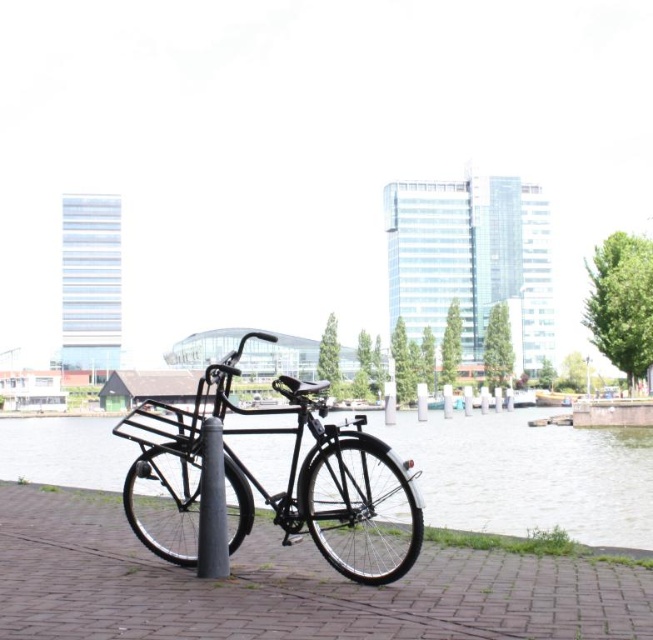
Does point (485, 584) come in front of point (471, 480)?

Yes, point (485, 584) is in front of point (471, 480).

Measure the distance between point (48, 589) and camera.

5.30 meters

Locate an element on the screen. black brick pavement at center is located at coordinates (287, 586).

Can you confirm if black brick pavement at center is positioned to the left of matte black bicycle at center?

In fact, black brick pavement at center is to the right of matte black bicycle at center.

Is black brick pavement at center closer to the viewer compared to matte black bicycle at center?

Yes.

The image size is (653, 640). In order to click on black brick pavement at center in this screenshot , I will do `click(287, 586)`.

Is clear water at center to the left of matte black bicycle at center from the viewer's perspective?

In fact, clear water at center is to the right of matte black bicycle at center.

Does clear water at center have a lesser height compared to matte black bicycle at center?

Incorrect, clear water at center's height does not fall short of matte black bicycle at center's.

The height and width of the screenshot is (640, 653). Identify the location of clear water at center. (528, 474).